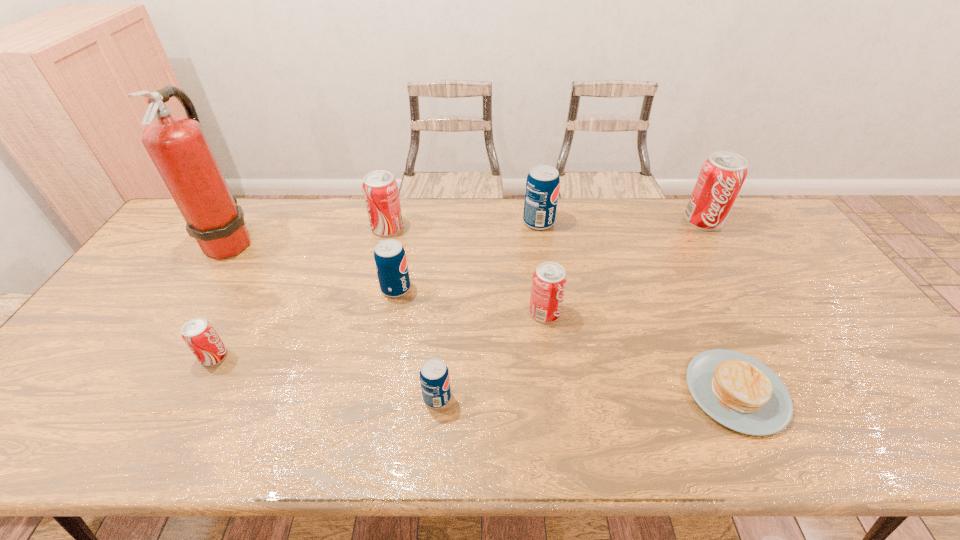
Where is `vacant space that is in between the eighth object from right to left and the rightmost pop`? vacant space that is in between the eighth object from right to left and the rightmost pop is located at coordinates tap(459, 289).

Where is `unoccupied position between the nearest red soda can and the leftmost blue pop`? This screenshot has height=540, width=960. unoccupied position between the nearest red soda can and the leftmost blue pop is located at coordinates (305, 322).

This screenshot has height=540, width=960. What are the coordinates of `object that stands as the eighth closest to the farthest blue pop` in the screenshot? It's located at (199, 335).

The width and height of the screenshot is (960, 540). Find the location of `the eighth closest object relative to the biggest red soda can`. the eighth closest object relative to the biggest red soda can is located at coordinates (178, 147).

Point out which pop is positioned as the nearest to the second biggest red soda can. Please provide its 2D coordinates. Your answer should be formatted as a tuple, i.e. [(x, y)], where the tuple contains the x and y coordinates of a point satisfying the conditions above.

[(390, 259)]

Choose which pop is the fourth nearest neighbor to the fourth pop from right to left. Please provide its 2D coordinates. Your answer should be formatted as a tuple, i.e. [(x, y)], where the tuple contains the x and y coordinates of a point satisfying the conditions above.

[(380, 189)]

Where is `the third closest red soda can relative to the rightmost red soda can`? This screenshot has width=960, height=540. the third closest red soda can relative to the rightmost red soda can is located at coordinates (199, 335).

Where is `red soda can that is the second closest to the smallest blue pop`? This screenshot has height=540, width=960. red soda can that is the second closest to the smallest blue pop is located at coordinates (199, 335).

Select which blue pop is the second closest to the leftmost red soda can. Please provide its 2D coordinates. Your answer should be formatted as a tuple, i.e. [(x, y)], where the tuple contains the x and y coordinates of a point satisfying the conditions above.

[(434, 376)]

You are a GUI agent. You are given a task and a screenshot of the screen. Output one action in this format:
    pyautogui.click(x=<x>, y=<y>)
    Task: Click on the blue pop that stands as the second closest to the tallest pop
    
    Given the screenshot: What is the action you would take?
    pyautogui.click(x=390, y=259)